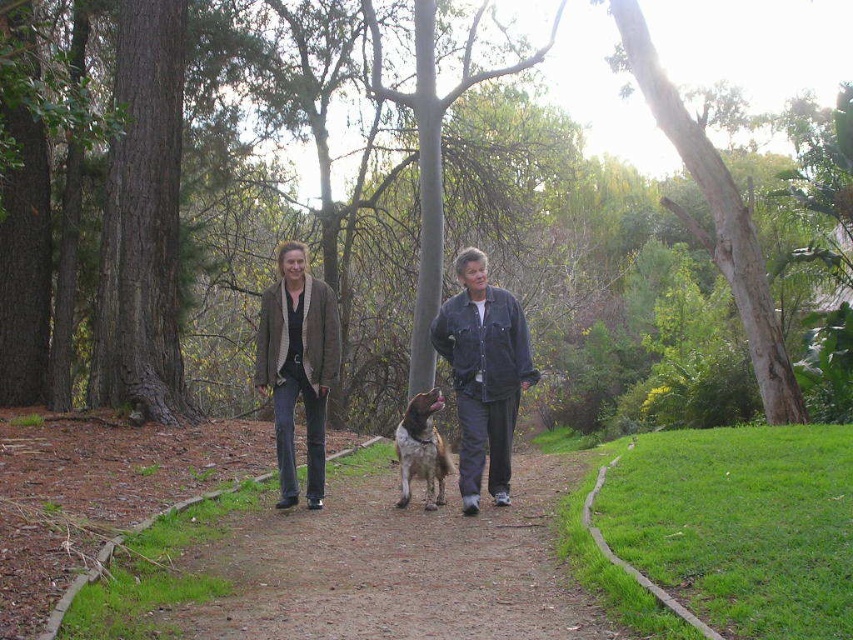
Question: Can you confirm if brown leather jacket at center is bigger than brown suede jacket at center?

Choices:
 (A) no
 (B) yes

Answer: (A)

Question: Does brown leather jacket at center have a greater width compared to brown speckled fur dog at center?

Choices:
 (A) no
 (B) yes

Answer: (B)

Question: Is brown suede jacket at center to the left of brown speckled fur dog at center from the viewer's perspective?

Choices:
 (A) yes
 (B) no

Answer: (A)

Question: Which point appears closest to the camera in this image?

Choices:
 (A) (291, 412)
 (B) (434, 500)

Answer: (A)

Question: Which point is closer to the camera?

Choices:
 (A) (509, 333)
 (B) (308, 458)
 (C) (503, 348)

Answer: (C)

Question: Based on their relative distances, which object is nearer to the brown speckled fur dog at center?

Choices:
 (A) brown suede jacket at center
 (B) brown leather jacket at center
 (C) denim jacket at center

Answer: (C)